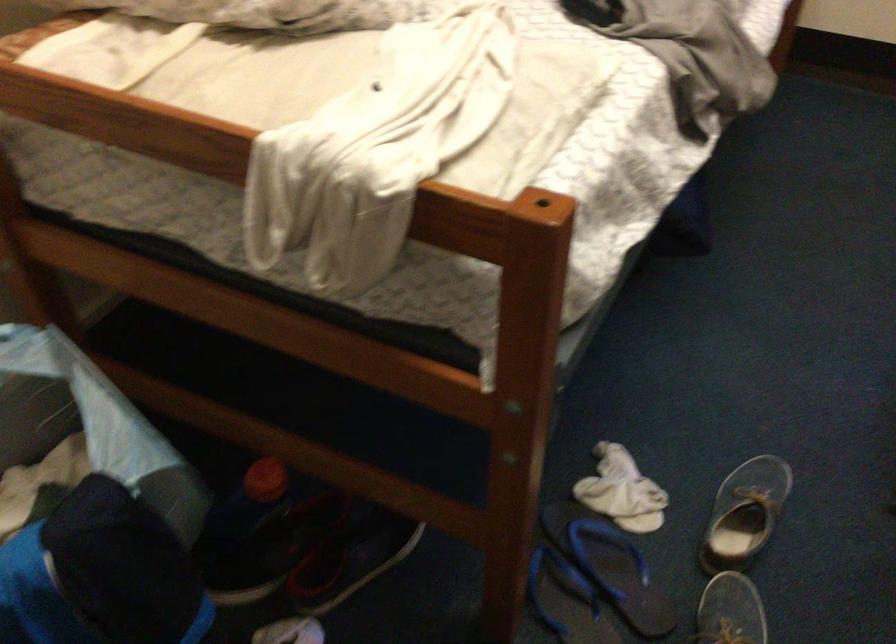
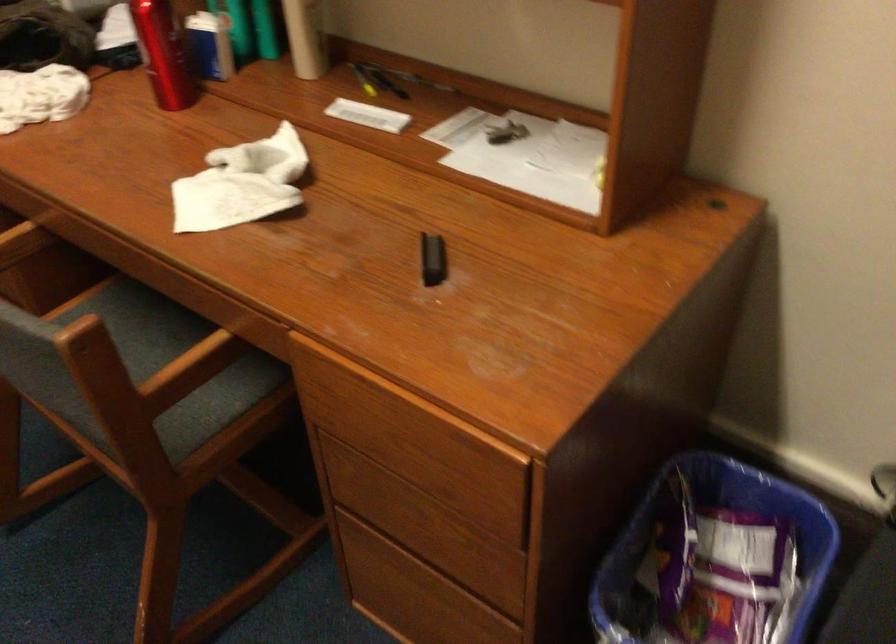
How did the camera likely rotate?

The camera's rotation is toward right-down.